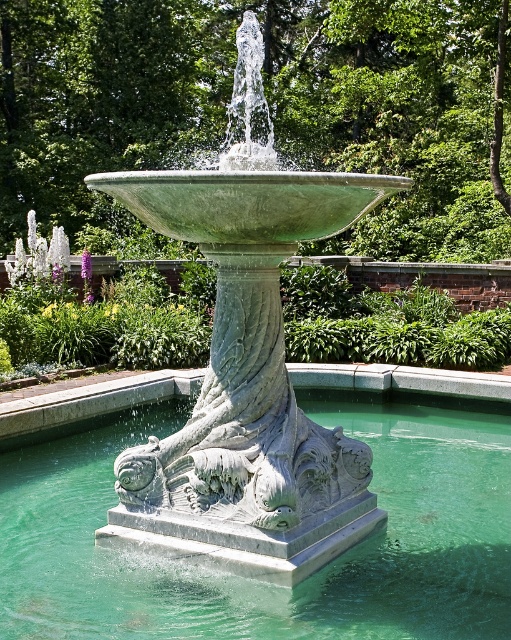
Question: Can you confirm if green stone water at center is positioned above green stone fountain at center?

Choices:
 (A) no
 (B) yes

Answer: (A)

Question: Is green stone water at center closer to camera compared to green stone fountain at center?

Choices:
 (A) yes
 (B) no

Answer: (A)

Question: Which point is closer to the camera?

Choices:
 (A) green stone fountain at center
 (B) green stone water at center

Answer: (B)

Question: Which of the following is the farthest from the observer?

Choices:
 (A) pyautogui.click(x=391, y=458)
 (B) pyautogui.click(x=193, y=486)

Answer: (A)

Question: In this image, where is green stone water at center located relative to green stone fountain at center?

Choices:
 (A) below
 (B) above

Answer: (A)